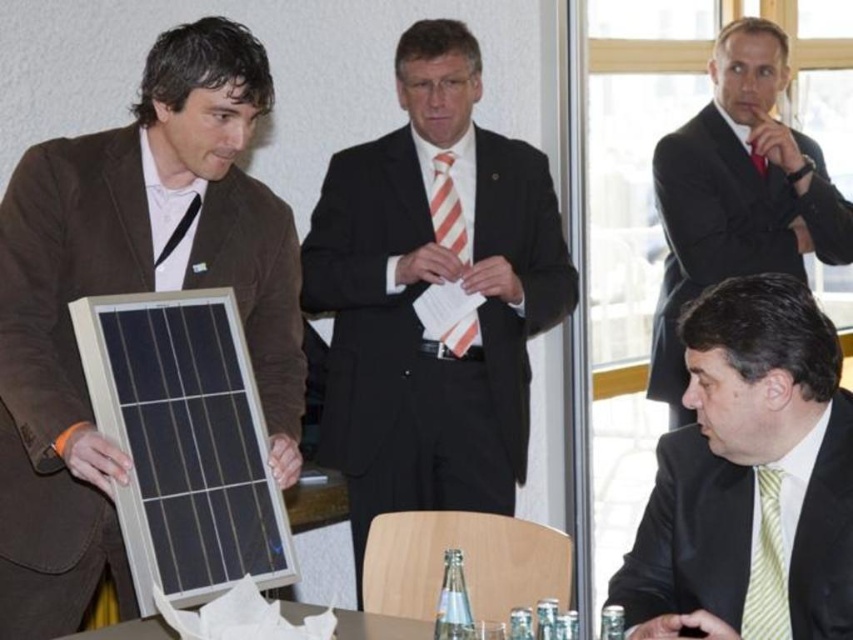
Measure the distance between matte black solar panel at left and black matte suit at center.

matte black solar panel at left is 36.72 inches away from black matte suit at center.

Is point (74, 509) less distant than point (322, 260)?

Yes, it is.

Is point (41, 461) less distant than point (399, 300)?

Yes, point (41, 461) is in front of point (399, 300).

Find the location of `matte black solar panel at left`. matte black solar panel at left is located at coordinates (131, 291).

Is point (648, 516) behind point (714, 264)?

No, (648, 516) is closer to viewer.

Which is behind, point (683, 465) or point (759, 33)?

The point (759, 33) is more distant.

Who is more distant from viewer, [711,380] or [779,35]?

The point [779,35] is more distant.

You are a GUI agent. You are given a task and a screenshot of the screen. Output one action in this format:
    pyautogui.click(x=<x>, y=<y>)
    Task: Click on the green striped tie at lower right
    The height and width of the screenshot is (640, 853).
    Given the screenshot: What is the action you would take?
    pyautogui.click(x=747, y=468)

Between point (799, 515) and point (781, 540), which one is positioned behind?

Point (781, 540)

Is green striped tie at lower right closer to camera compared to yellow striped tie at lower right?

Yes, green striped tie at lower right is in front of yellow striped tie at lower right.

At what (x,y) coordinates should I click in order to perform the action: click on green striped tie at lower right. Please return your answer as a coordinate pair (x, y). The image size is (853, 640). Looking at the image, I should click on (747, 468).

Image resolution: width=853 pixels, height=640 pixels. Find the location of `green striped tie at lower right`. green striped tie at lower right is located at coordinates (747, 468).